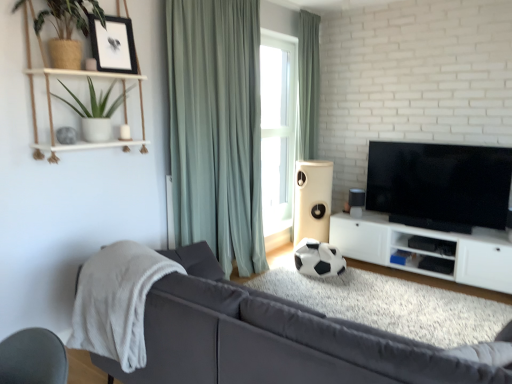
Question: Is black matte picture frame at upper left closer to the viewer compared to light green fabric curtain at upper center, which is counted as the 1th curtain, starting from the back?

Choices:
 (A) yes
 (B) no

Answer: (A)

Question: Considering the relative positions of black matte picture frame at upper left and light green fabric curtain at upper center, placed as the 2th curtain when sorted from left to right, in the image provided, is black matte picture frame at upper left to the right of light green fabric curtain at upper center, placed as the 2th curtain when sorted from left to right, from the viewer's perspective?

Choices:
 (A) yes
 (B) no

Answer: (B)

Question: Is black matte picture frame at upper left with light green fabric curtain at upper center, the second curtain from the front?

Choices:
 (A) yes
 (B) no

Answer: (B)

Question: Does black matte picture frame at upper left have a greater height compared to light green fabric curtain at upper center, which is counted as the 1th curtain, starting from the back?

Choices:
 (A) yes
 (B) no

Answer: (B)

Question: Is black matte picture frame at upper left far from light green fabric curtain at upper center, the second curtain from the front?

Choices:
 (A) no
 (B) yes

Answer: (B)

Question: From the image's perspective, is green matte plant at upper left located above or below white fluffy blanket at left?

Choices:
 (A) above
 (B) below

Answer: (A)

Question: Considering the positions of point (99, 74) and point (138, 327), is point (99, 74) closer or farther from the camera than point (138, 327)?

Choices:
 (A) closer
 (B) farther

Answer: (B)

Question: Based on their sizes in the image, would you say green matte plant at upper left is bigger or smaller than white fluffy blanket at left?

Choices:
 (A) big
 (B) small

Answer: (B)

Question: Is green matte plant at upper left in front of or behind white fluffy blanket at left in the image?

Choices:
 (A) front
 (B) behind

Answer: (B)

Question: Considering the relative positions of white wood shelf at upper left and matte gray couch at center in the image provided, is white wood shelf at upper left to the left or to the right of matte gray couch at center?

Choices:
 (A) left
 (B) right

Answer: (A)

Question: Is white wood shelf at upper left inside the boundaries of matte gray couch at center, or outside?

Choices:
 (A) outside
 (B) inside

Answer: (A)

Question: From the image's perspective, is white wood shelf at upper left located above or below matte gray couch at center?

Choices:
 (A) below
 (B) above

Answer: (B)

Question: From a real-world perspective, is white wood shelf at upper left positioned above or below matte gray couch at center?

Choices:
 (A) below
 (B) above

Answer: (B)

Question: From their relative heights in the image, would you say white fluffy blanket at left is taller or shorter than green fabric curtain at center, the 2th curtain viewed from the right?

Choices:
 (A) tall
 (B) short

Answer: (B)

Question: Is white fluffy blanket at left bigger or smaller than green fabric curtain at center, which is the first curtain from left to right?

Choices:
 (A) small
 (B) big

Answer: (A)